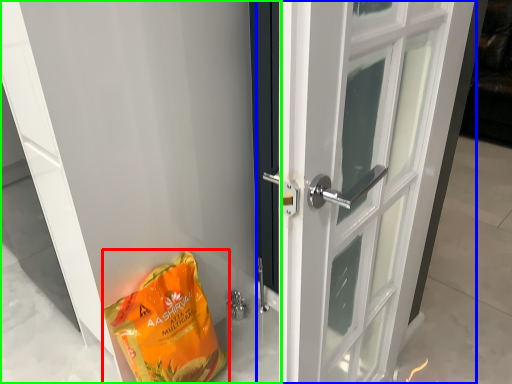
Question: Which object is positioned closest to grocery bag (highlighted by a red box)? Select from door (highlighted by a blue box) and door (highlighted by a green box).

Choices:
 (A) door
 (B) door

Answer: (B)